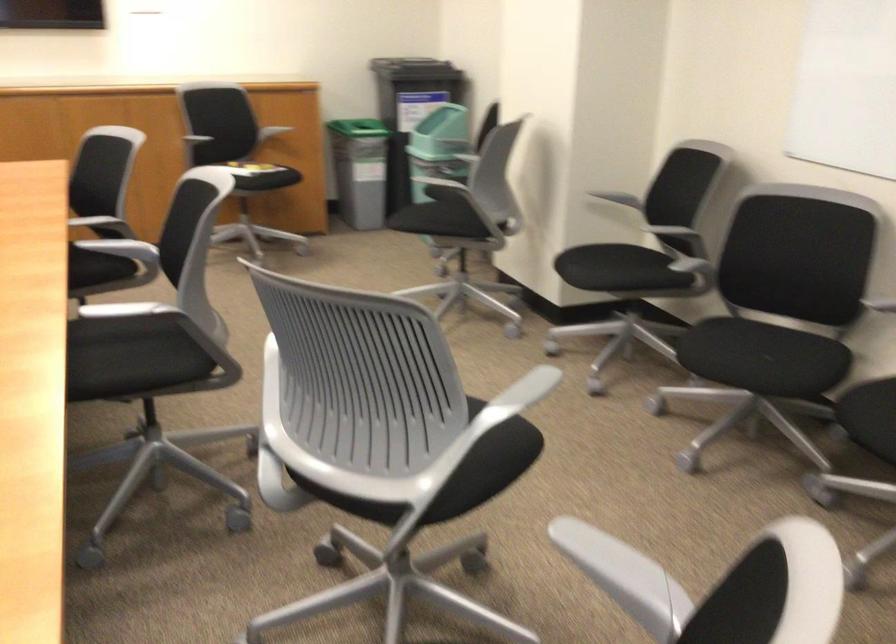
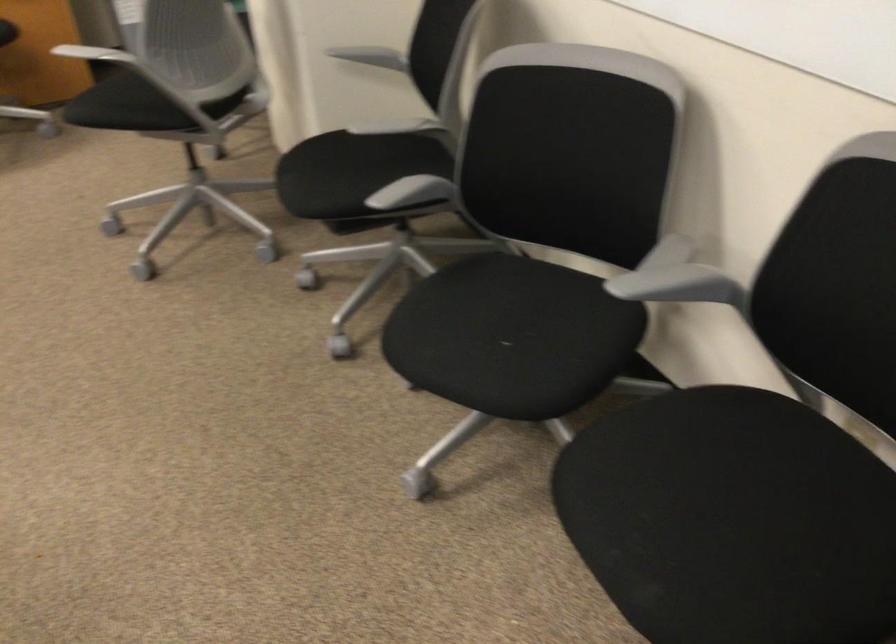
Find the pixel in the second image that matches [583,261] in the first image.

(319, 176)